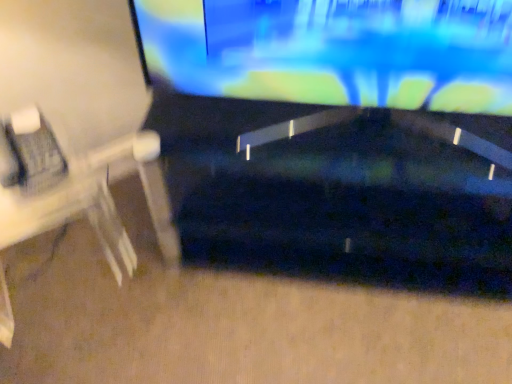
Question: Are glossy black television at upper center and white plastic computer desk at left beside each other?

Choices:
 (A) no
 (B) yes

Answer: (A)

Question: Considering the relative sizes of glossy black television at upper center and white plastic computer desk at left in the image provided, is glossy black television at upper center wider than white plastic computer desk at left?

Choices:
 (A) yes
 (B) no

Answer: (B)

Question: From a real-world perspective, is glossy black television at upper center physically below white plastic computer desk at left?

Choices:
 (A) yes
 (B) no

Answer: (B)

Question: Can you confirm if glossy black television at upper center is positioned to the left of white plastic computer desk at left?

Choices:
 (A) no
 (B) yes

Answer: (A)

Question: Is glossy black television at upper center smaller than white plastic computer desk at left?

Choices:
 (A) yes
 (B) no

Answer: (A)

Question: From the image's perspective, is glossy black television at upper center under white plastic computer desk at left?

Choices:
 (A) no
 (B) yes

Answer: (A)

Question: Is white plastic computer desk at left to the left of glossy black television at upper center from the viewer's perspective?

Choices:
 (A) yes
 (B) no

Answer: (A)

Question: Is white plastic computer desk at left not close to glossy black television at upper center?

Choices:
 (A) yes
 (B) no

Answer: (B)

Question: Is glossy black television at upper center at the back of white plastic computer desk at left?

Choices:
 (A) yes
 (B) no

Answer: (B)

Question: Does white plastic computer desk at left have a larger size compared to glossy black television at upper center?

Choices:
 (A) no
 (B) yes

Answer: (B)

Question: Is white plastic computer desk at left positioned in front of glossy black television at upper center?

Choices:
 (A) no
 (B) yes

Answer: (A)

Question: Does white plastic computer desk at left appear on the right side of glossy black television at upper center?

Choices:
 (A) yes
 (B) no

Answer: (B)

Question: From the image's perspective, is white plastic computer desk at left positioned above or below glossy black television at upper center?

Choices:
 (A) above
 (B) below

Answer: (B)